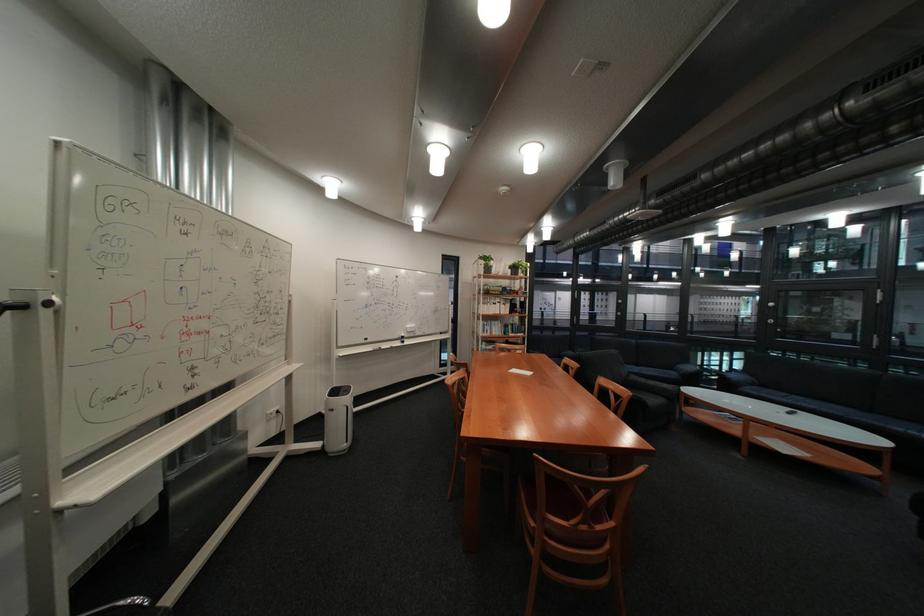
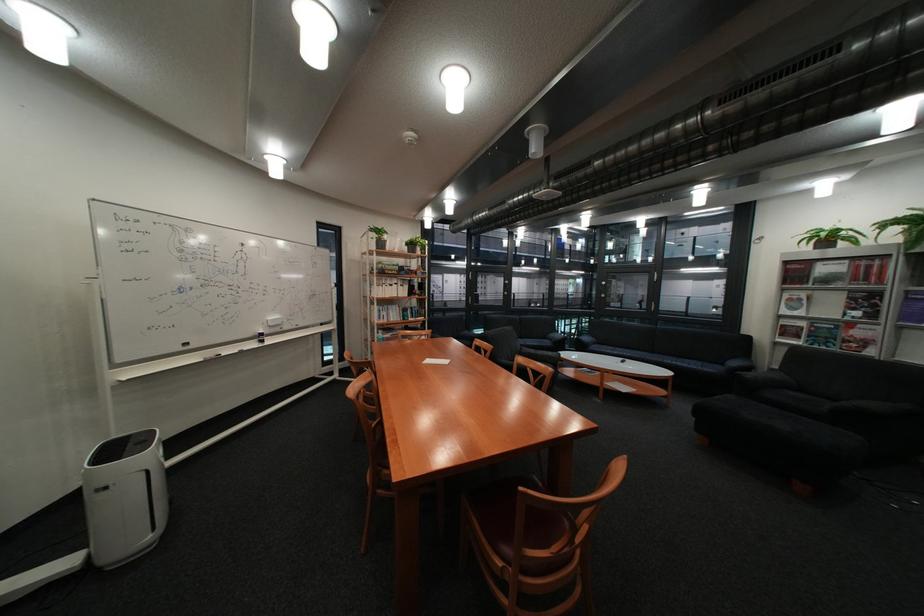
Find the pixel in the second image that matches the point at 526,268 in the first image.

(421, 245)